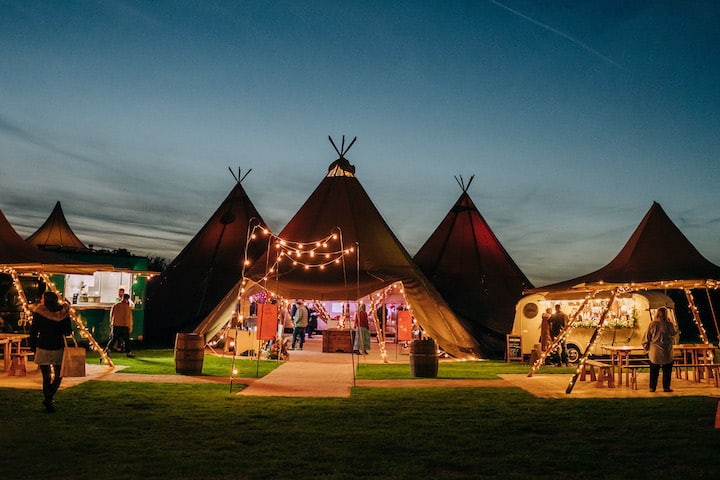
Find the location of a particular element. The height and width of the screenshot is (480, 720). table is located at coordinates (611, 386).